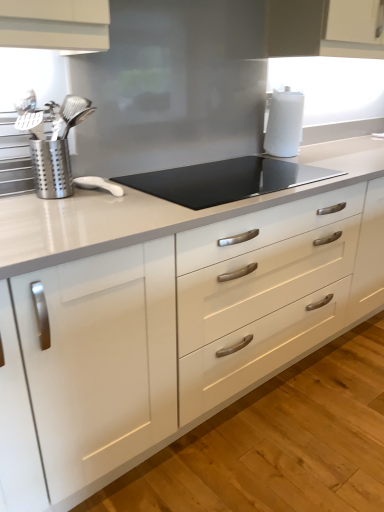
Question: From a real-world perspective, is black glass cooktop at center under white glossy countertop at center?

Choices:
 (A) yes
 (B) no

Answer: (B)

Question: From a real-world perspective, does black glass cooktop at center stand above white glossy countertop at center?

Choices:
 (A) no
 (B) yes

Answer: (B)

Question: Does black glass cooktop at center turn towards white glossy countertop at center?

Choices:
 (A) yes
 (B) no

Answer: (A)

Question: Is the position of black glass cooktop at center more distant than that of white glossy countertop at center?

Choices:
 (A) yes
 (B) no

Answer: (A)

Question: Considering the relative sizes of black glass cooktop at center and white glossy countertop at center in the image provided, is black glass cooktop at center wider than white glossy countertop at center?

Choices:
 (A) yes
 (B) no

Answer: (B)

Question: Which is correct: black glass cooktop at center is inside white matte paper towel at upper right, or outside of it?

Choices:
 (A) outside
 (B) inside

Answer: (A)

Question: Is point (173, 197) closer or farther from the camera than point (284, 138)?

Choices:
 (A) farther
 (B) closer

Answer: (B)

Question: Is black glass cooktop at center wider or thinner than white matte paper towel at upper right?

Choices:
 (A) wide
 (B) thin

Answer: (A)

Question: Visually, is black glass cooktop at center positioned to the left or to the right of white matte paper towel at upper right?

Choices:
 (A) left
 (B) right

Answer: (A)

Question: Is black glass cooktop at center inside or outside of white glossy countertop at center?

Choices:
 (A) outside
 (B) inside

Answer: (B)

Question: From a real-world perspective, is black glass cooktop at center positioned above or below white glossy countertop at center?

Choices:
 (A) below
 (B) above

Answer: (B)

Question: In the image, is black glass cooktop at center on the left side or the right side of white glossy countertop at center?

Choices:
 (A) left
 (B) right

Answer: (A)

Question: Relative to white glossy countertop at center, is black glass cooktop at center in front or behind?

Choices:
 (A) front
 (B) behind

Answer: (B)

Question: Is white glossy countertop at center spatially inside silver metallic utensil holder at left, or outside of it?

Choices:
 (A) inside
 (B) outside

Answer: (B)

Question: Looking at their shapes, would you say white glossy countertop at center is wider or thinner than silver metallic utensil holder at left?

Choices:
 (A) thin
 (B) wide

Answer: (B)